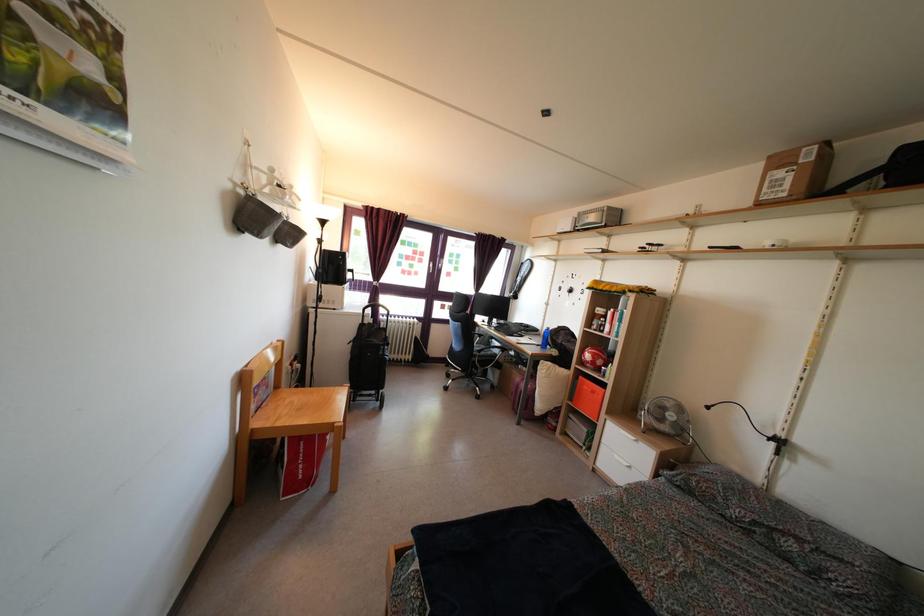
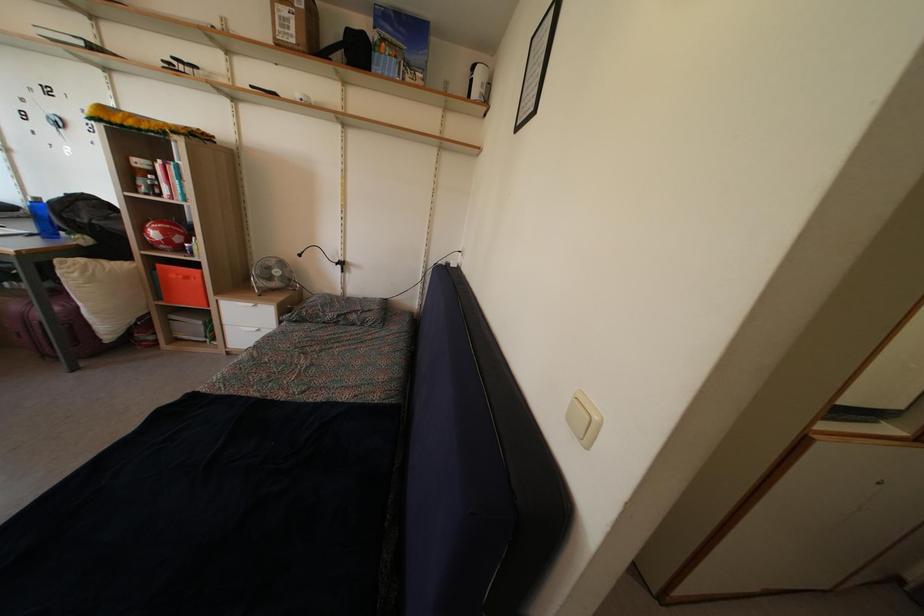
Where in the second image is the point corresponding to the point at 599,291 from the first image?

(106, 116)